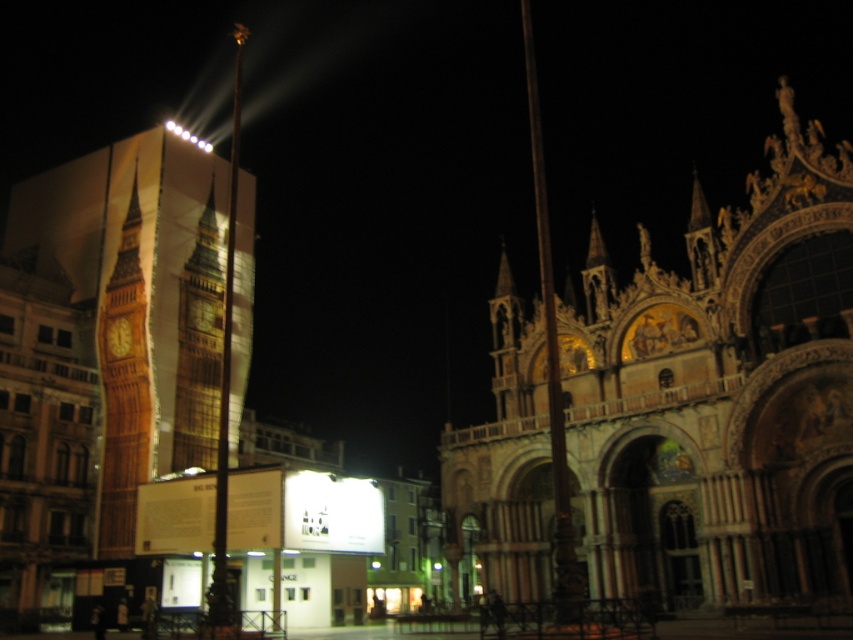
Question: Among these points, which one is nearest to the camera?

Choices:
 (A) (108, 500)
 (B) (213, 298)
 (C) (47, 196)

Answer: (A)

Question: Which point appears farthest from the camera in this image?

Choices:
 (A) (131, 548)
 (B) (204, 221)
 (C) (567, 616)

Answer: (B)

Question: Does golden stone church at left lie in front of polished metal flag pole at center?

Choices:
 (A) yes
 (B) no

Answer: (B)

Question: Can you confirm if golden stone church at left is wider than polished metal flag pole at center?

Choices:
 (A) no
 (B) yes

Answer: (B)

Question: Is polished metal flag pole at center smaller than shiny metallic flag pole at center?

Choices:
 (A) yes
 (B) no

Answer: (A)

Question: Among these objects, which one is nearest to the camera?

Choices:
 (A) wooden big ben at left
 (B) polished metal flag pole at center
 (C) golden stone church at left

Answer: (B)